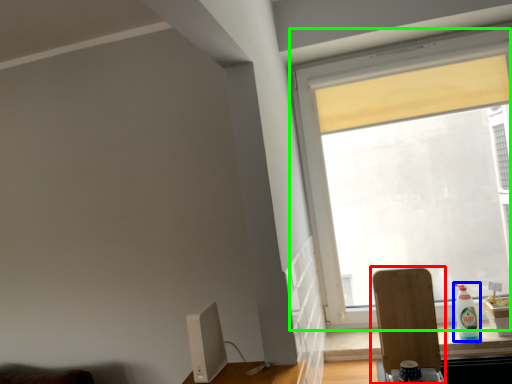
Question: Which object is positioned farthest from swivel chair (highlighted by a red box)? Select from bottle (highlighted by a blue box) and window (highlighted by a green box).

Choices:
 (A) bottle
 (B) window

Answer: (B)